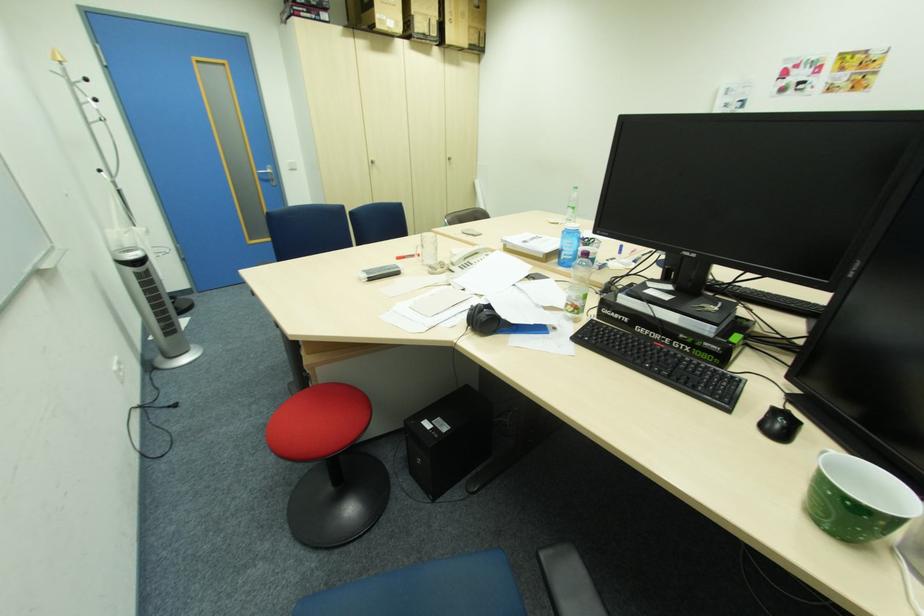
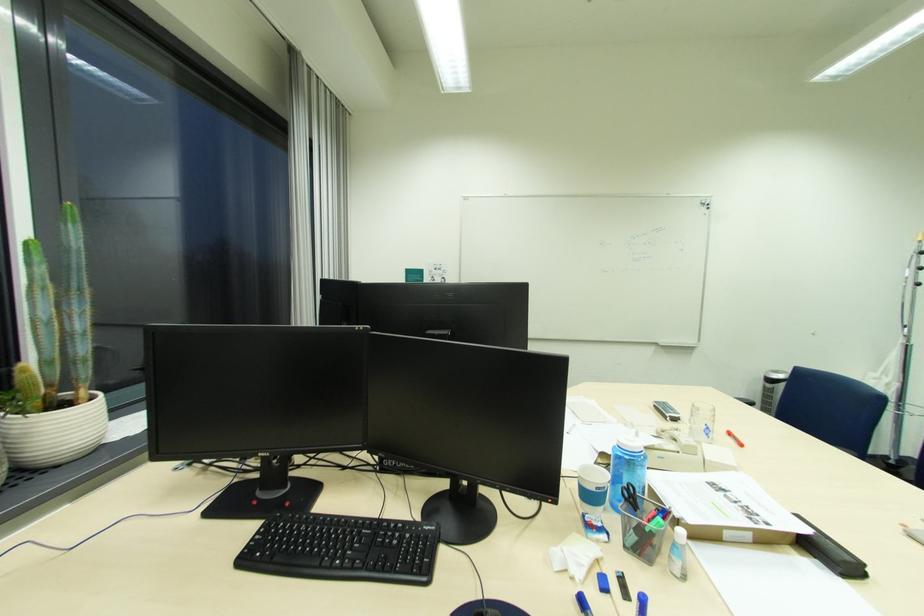
In the second image, find the point that corresponds to (x=530, y=241) in the first image.

(731, 491)